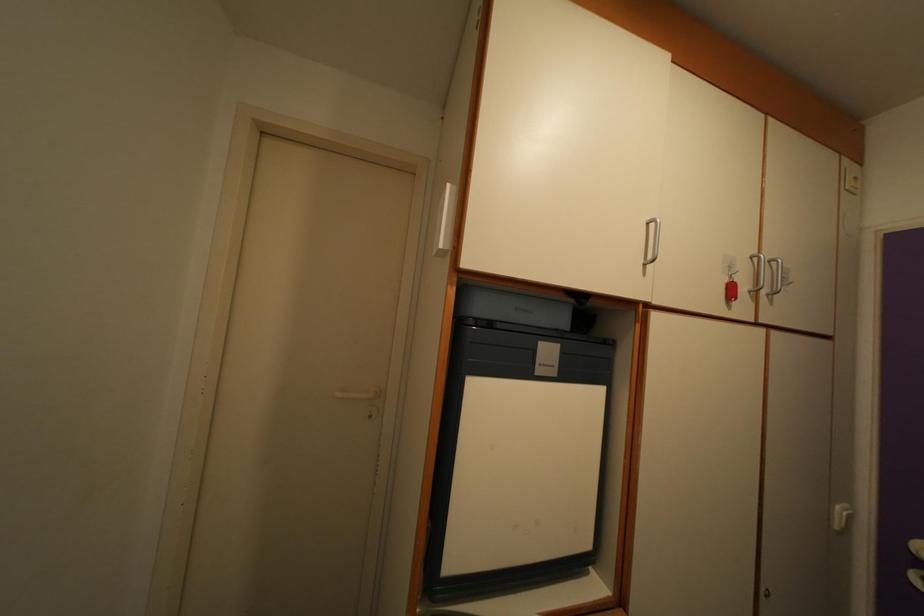
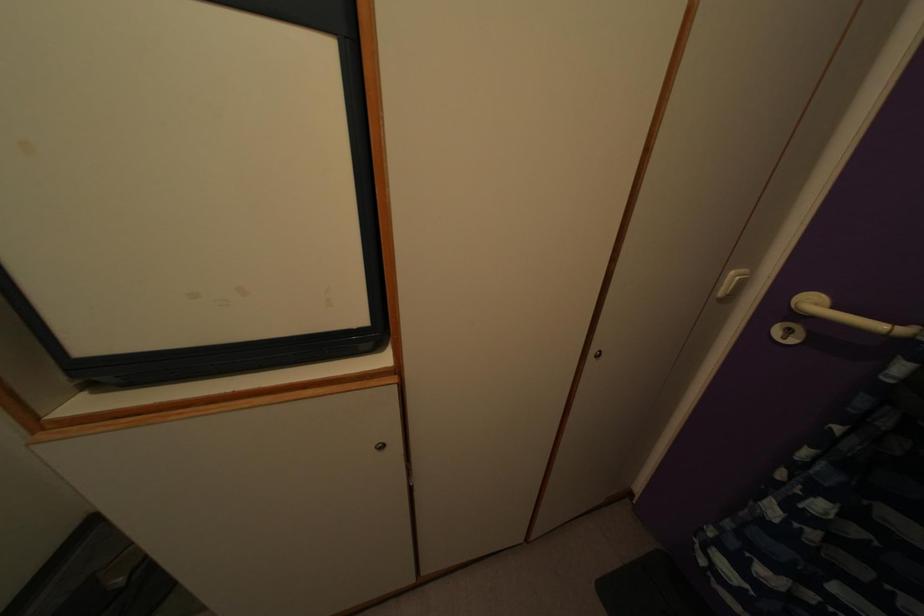
Locate, in the second image, the point that corresponds to (x=843, y=519) in the first image.

(736, 284)